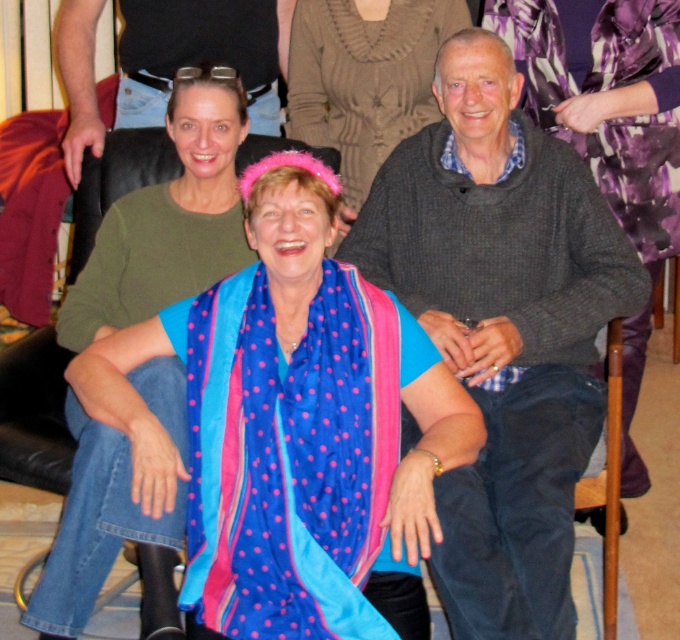
Can you confirm if knitted gray sweater at center is taller than matte green sweater at upper left?

Correct, knitted gray sweater at center is much taller as matte green sweater at upper left.

Does point (452, 508) lie in front of point (156, 202)?

Yes, point (452, 508) is closer to viewer.

You are a GUI agent. You are given a task and a screenshot of the screen. Output one action in this format:
    pyautogui.click(x=<x>, y=<y>)
    Task: Click on the knitted gray sweater at center
    The width and height of the screenshot is (680, 640).
    Given the screenshot: What is the action you would take?
    pyautogui.click(x=503, y=326)

Can you confirm if blue silk scarf at center is bigger than pink fabric headband at center?

Yes.

How far apart are blue silk scarf at center and pink fabric headband at center?

blue silk scarf at center is 34.56 inches away from pink fabric headband at center.

Consider the image. Who is more distant from viewer, (137, 353) or (357, 209)?

The point (357, 209) is more distant.

Identify the location of blue silk scarf at center. The width and height of the screenshot is (680, 640). (309, 422).

Between point (528, 440) and point (456, 13), which one is positioned in front?

Point (528, 440) is more forward.

Can you confirm if knitted gray sweater at center is thinner than pink fabric headband at center?

No.

Is point (447, 577) in front of point (345, 81)?

Yes.

This screenshot has height=640, width=680. In order to click on knitted gray sweater at center in this screenshot , I will do point(503,326).